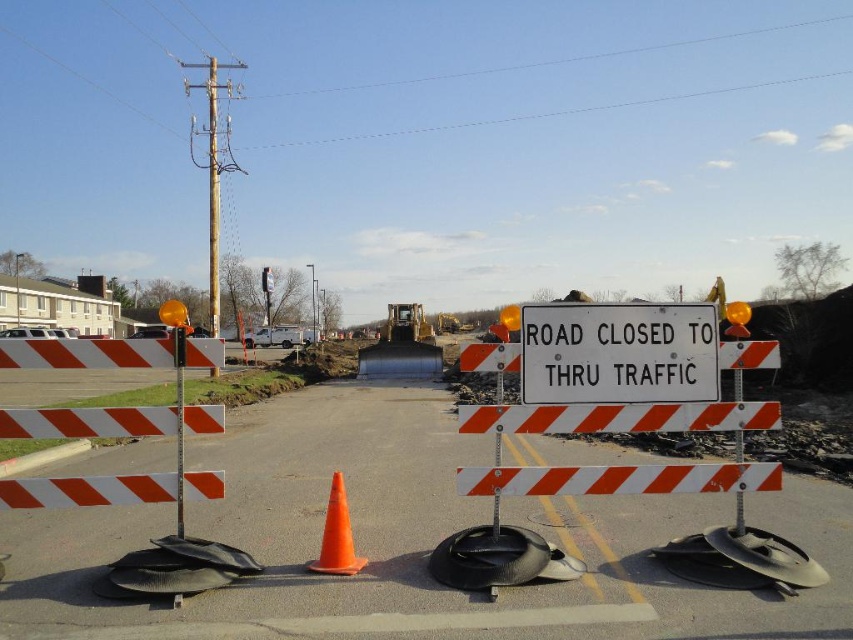
Who is higher up, white plastic sign at center or orange matte/cone at center?

white plastic sign at center is higher up.

Describe the element at coordinates (618, 353) in the screenshot. This screenshot has width=853, height=640. I see `white plastic sign at center` at that location.

Does point (654, 333) lie in front of point (347, 556)?

Yes, point (654, 333) is closer to viewer.

The width and height of the screenshot is (853, 640). Identify the location of white plastic sign at center. (618, 353).

Can you confirm if white reflective barricade at center is positioned above white plastic sign at center?

No.

Based on the photo, how much distance is there between white reflective barricade at center and white plastic sign at center?

white reflective barricade at center and white plastic sign at center are 2.28 meters apart from each other.

Is point (419, 506) farther from camera compared to point (659, 394)?

Yes, it is.

This screenshot has width=853, height=640. Identify the location of white reflective barricade at center. (402, 540).

Which is more to the right, white reflective barricade at center or orange matte/cone at center?

orange matte/cone at center is more to the right.

Can you confirm if white reflective barricade at center is bigger than orange matte/cone at center?

Yes.

Is point (380, 512) positioned before point (340, 490)?

No, (380, 512) is behind (340, 490).

Where is `white reflective barricade at center`? The height and width of the screenshot is (640, 853). white reflective barricade at center is located at coordinates (402, 540).